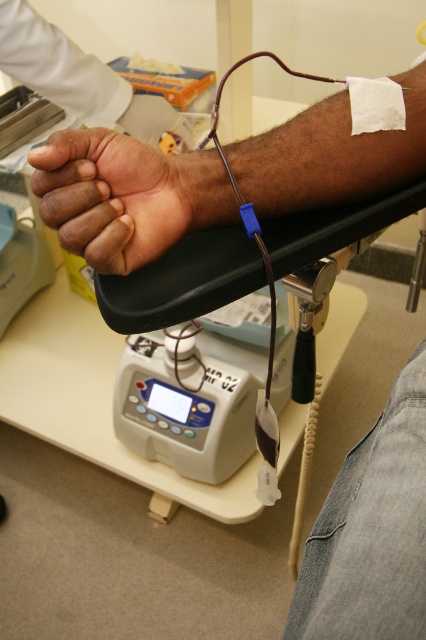
You are a medical technician observing the blood donation setup. You notice two points marked on the arm where you need to place sensors to monitor blood flow. The points are labeled as point 1 at coordinates (68, 152) and point 2 at (51, 189). Based on their positions, which point is closer to you and should be accessed first?

Point 1 at coordinates (68, 152) is closer to the viewer than point 2 at (51, 189), so you should access point 1 first.

You are a nurse preparing to administer a blood donation. You need to ensure the distance between the dark skin arm at upper center and the dark skin palm at center is at least 2 inches to properly position the medical equipment. Based on the scene, is the current distance sufficient?

The dark skin arm at upper center and dark skin palm at center are 1.94 inches apart from each other, which is less than the required 2 inches. Therefore, the current distance is insufficient for proper positioning.

You are a medical assistant observing the blood donation setup. You need to adjust the height of the dark skin arm at upper center and the dark skin palm at center to ensure proper blood flow. Which object should you raise to achieve this?

The dark skin arm at upper center has a greater height compared to dark skin palm at center. To ensure proper blood flow, you should raise the dark skin palm at center to match or slightly exceed the height of the dark skin arm at upper center.